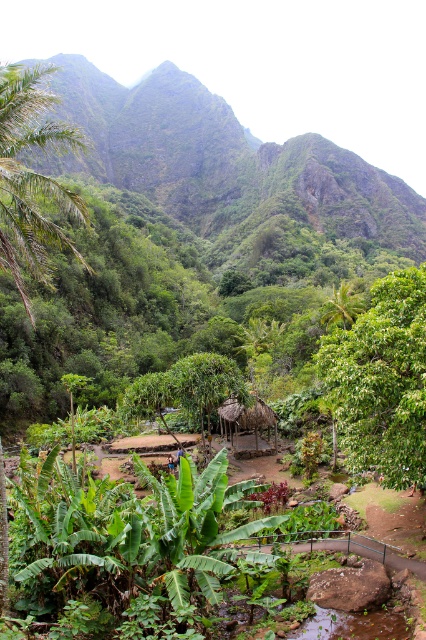
Which is more to the left, green leafy mountain at upper center or brown thatched hut at center?

Positioned to the left is green leafy mountain at upper center.

The width and height of the screenshot is (426, 640). Describe the element at coordinates (227, 170) in the screenshot. I see `green leafy mountain at upper center` at that location.

I want to click on green leafy mountain at upper center, so click(x=227, y=170).

Is point (164, 184) less distant than point (373, 321)?

No, (164, 184) is behind (373, 321).

Which is in front, point (258, 241) or point (356, 356)?

Point (356, 356)

You are a GUI agent. You are given a task and a screenshot of the screen. Output one action in this format:
    pyautogui.click(x=<x>, y=<y>)
    Task: Click on the green leafy mountain at upper center
    
    Given the screenshot: What is the action you would take?
    pyautogui.click(x=227, y=170)

Who is higher up, green leafy palm tree at left or green leafy palm tree at center?

green leafy palm tree at left is higher up.

Can you confirm if green leafy palm tree at left is taller than green leafy palm tree at center?

Yes, green leafy palm tree at left is taller than green leafy palm tree at center.

Describe the element at coordinates (31, 177) in the screenshot. I see `green leafy palm tree at left` at that location.

Image resolution: width=426 pixels, height=640 pixels. Find the location of `green leafy palm tree at left`. green leafy palm tree at left is located at coordinates (31, 177).